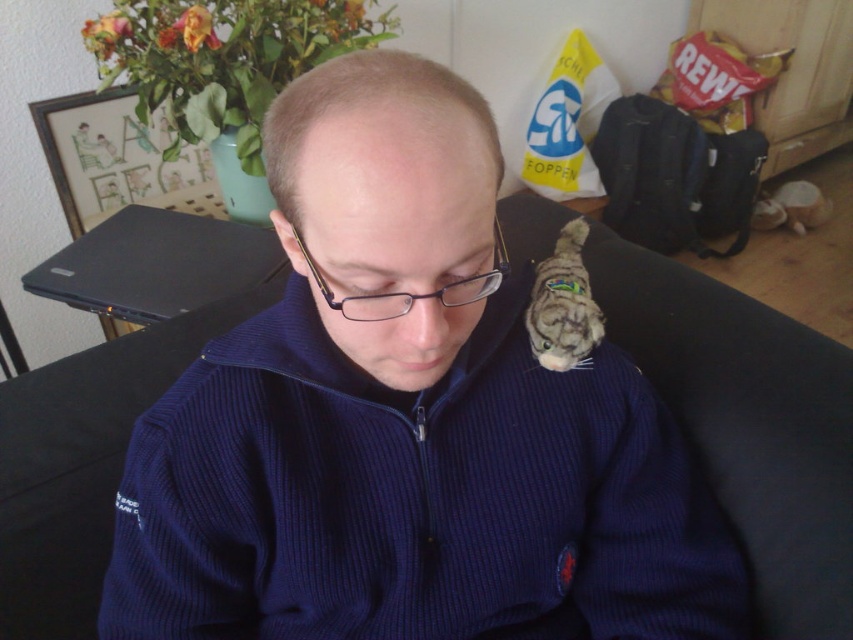
Which of these two, navy corduroy sweater at center or fuzzy gray cat at center, stands shorter?

Standing shorter between the two is fuzzy gray cat at center.

The width and height of the screenshot is (853, 640). What do you see at coordinates (407, 420) in the screenshot? I see `navy corduroy sweater at center` at bounding box center [407, 420].

Between point (374, 426) and point (543, 326), which one is positioned in front?

Point (374, 426)

This screenshot has width=853, height=640. What are the coordinates of `navy corduroy sweater at center` in the screenshot? It's located at (407, 420).

Which is below, navy corduroy sweater at center or blue corduroy head at center?

Positioned lower is navy corduroy sweater at center.

Consider the image. Can you confirm if navy corduroy sweater at center is positioned below blue corduroy head at center?

Yes.

Image resolution: width=853 pixels, height=640 pixels. Describe the element at coordinates (407, 420) in the screenshot. I see `navy corduroy sweater at center` at that location.

Locate an element on the screen. The image size is (853, 640). navy corduroy sweater at center is located at coordinates (407, 420).

The height and width of the screenshot is (640, 853). In order to click on blue corduroy head at center in this screenshot , I will do `click(387, 205)`.

Locate an element on the screen. The height and width of the screenshot is (640, 853). blue corduroy head at center is located at coordinates (387, 205).

Where is `blue corduroy head at center`? This screenshot has height=640, width=853. blue corduroy head at center is located at coordinates (387, 205).